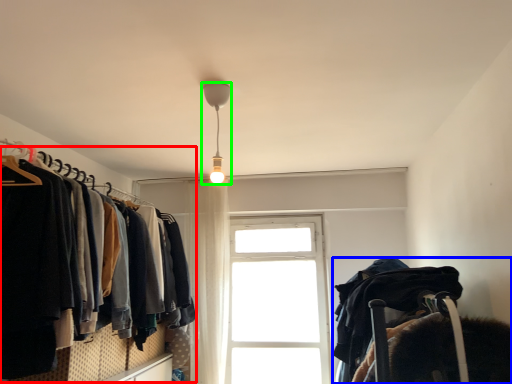
Question: Which object is positioned farthest from closet (highlighted by a red box)? Select from bunk bed (highlighted by a blue box) and lamp (highlighted by a green box).

Choices:
 (A) bunk bed
 (B) lamp

Answer: (A)